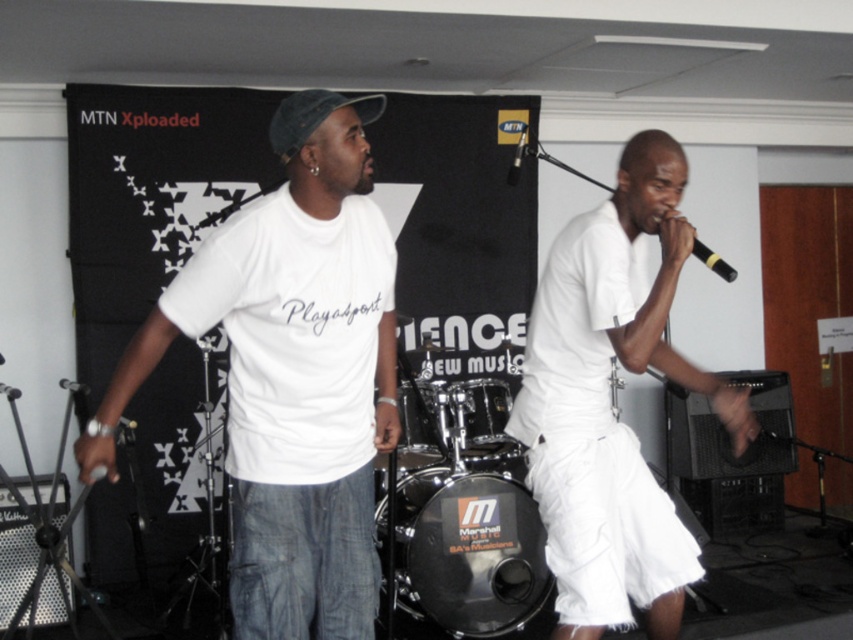
Between white cotton t-shirt at center and black drum at center, which one appears on the right side from the viewer's perspective?

black drum at center is more to the right.

Between white cotton t-shirt at center and black drum at center, which one has more height?

white cotton t-shirt at center

Locate an element on the screen. The image size is (853, 640). white cotton t-shirt at center is located at coordinates (291, 374).

Is white cotton shorts at right to the right of black drum at center from the viewer's perspective?

Yes, white cotton shorts at right is to the right of black drum at center.

Which is more to the right, white cotton shorts at right or black drum at center?

Positioned to the right is white cotton shorts at right.

Which is behind, point (573, 272) or point (399, 401)?

The point (399, 401) is more distant.

The height and width of the screenshot is (640, 853). I want to click on white cotton shorts at right, so click(610, 403).

Can you confirm if black drum at center is bigger than black matte microphone at upper right?

Indeed, black drum at center has a larger size compared to black matte microphone at upper right.

Which is in front, point (436, 456) or point (718, 256)?

Positioned in front is point (436, 456).

Where is `black drum at center`? This screenshot has height=640, width=853. black drum at center is located at coordinates (418, 426).